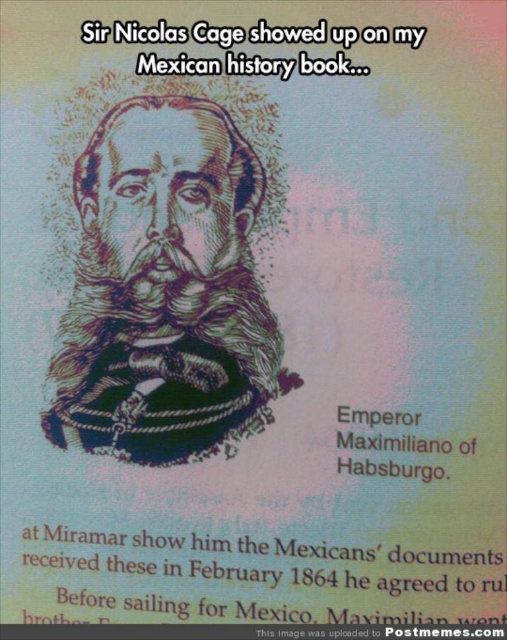
Is brown textured beard at center taller than white paper text at upper center?

Yes.

In the scene shown: Can you confirm if brown textured beard at center is thinner than white paper text at upper center?

Indeed, brown textured beard at center has a lesser width compared to white paper text at upper center.

Is point (167, 388) more distant than point (221, 45)?

Yes, point (167, 388) is farther from viewer.

Identify the location of brown textured beard at center. (164, 344).

Is brown ink portrait at center below white paper text at upper center?

Yes.

Is brown ink portrait at center to the left of white paper text at upper center from the viewer's perspective?

Indeed, brown ink portrait at center is positioned on the left side of white paper text at upper center.

Image resolution: width=507 pixels, height=640 pixels. Find the location of `brown ink portrait at center`. brown ink portrait at center is located at coordinates (165, 291).

Between black paper text at lower center and white paper text at upper center, which one appears on the right side from the viewer's perspective?

From the viewer's perspective, black paper text at lower center appears more on the right side.

Can you confirm if black paper text at lower center is shorter than white paper text at upper center?

In fact, black paper text at lower center may be taller than white paper text at upper center.

Find the location of a particular element. This screenshot has height=640, width=507. black paper text at lower center is located at coordinates click(263, 577).

Image resolution: width=507 pixels, height=640 pixels. Identify the location of black paper text at lower center. (263, 577).